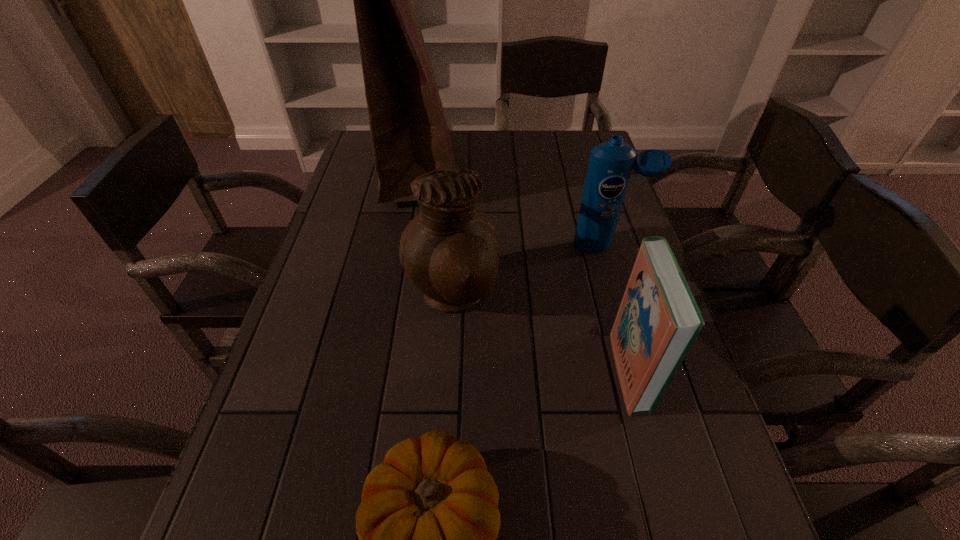
Locate an element on the screen. The width and height of the screenshot is (960, 540). the tallest object is located at coordinates (409, 132).

Find the location of a particular element. The image size is (960, 540). the farthest object is located at coordinates (409, 132).

Identify the location of pitcher. The image size is (960, 540). (450, 251).

Locate an element on the screen. This screenshot has height=540, width=960. shampoo is located at coordinates (611, 163).

You are a GUI agent. You are given a task and a screenshot of the screen. Output one action in this format:
    pyautogui.click(x=<x>, y=<y>)
    Task: Click on the hardback book
    The width and height of the screenshot is (960, 540).
    Given the screenshot: What is the action you would take?
    pyautogui.click(x=658, y=320)

Where is `vacant space positioned 0.120m on the front-facing side of the farthest object`? The image size is (960, 540). vacant space positioned 0.120m on the front-facing side of the farthest object is located at coordinates (501, 171).

Locate an element on the screen. vacant space positioned at the spout of the pitcher is located at coordinates (546, 297).

Identify the location of free space located 0.230m on the left of the shampoo. (487, 245).

Image resolution: width=960 pixels, height=540 pixels. I want to click on free spot located 0.260m on the cover of the hardback book, so click(490, 370).

Where is `free location located on the cover of the hardback book`? This screenshot has width=960, height=540. free location located on the cover of the hardback book is located at coordinates (445, 370).